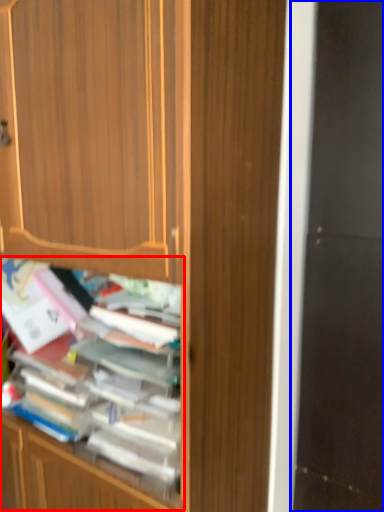
Question: Which of the following is the farthest to the observer, shelf (highlighted by a red box) or screen door (highlighted by a blue box)?

Choices:
 (A) shelf
 (B) screen door

Answer: (B)